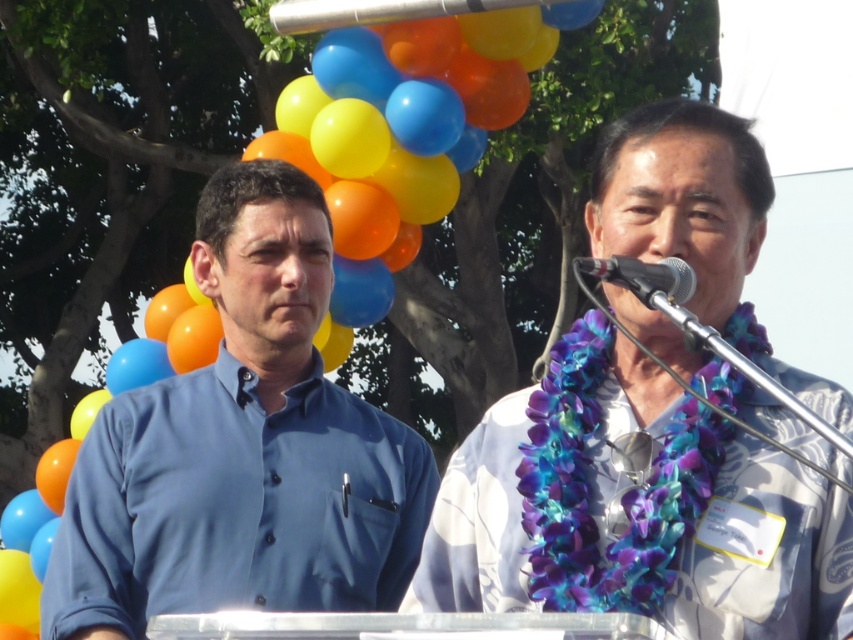
Measure the distance between blue floral lei at center and matte blue shirt at center.

blue floral lei at center and matte blue shirt at center are 30.95 feet apart.

What do you see at coordinates (633, 508) in the screenshot? The width and height of the screenshot is (853, 640). I see `blue floral lei at center` at bounding box center [633, 508].

Where is `blue floral lei at center`? This screenshot has height=640, width=853. blue floral lei at center is located at coordinates (633, 508).

Is matte blue shirt at center bigger than metallic silver microphone at upper center?

Incorrect, matte blue shirt at center is not larger than metallic silver microphone at upper center.

Between point (312, 285) and point (619, 264), which one is positioned behind?

Point (312, 285)

Where is `matte blue shirt at center`? This screenshot has height=640, width=853. matte blue shirt at center is located at coordinates (242, 449).

Is the position of blue floral lei at center more distant than that of metallic silver microphone at upper center?

Yes, it is behind metallic silver microphone at upper center.

Does point (548, 456) come closer to viewer compared to point (691, 284)?

No.

Is point (486, 547) closer to camera compared to point (639, 273)?

That is False.

This screenshot has height=640, width=853. Identify the location of blue floral lei at center. (633, 508).